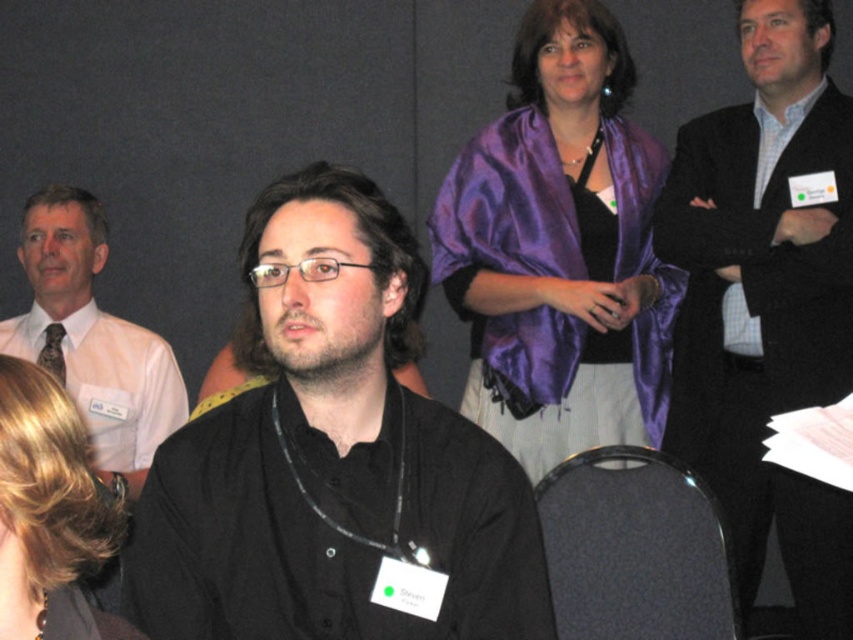
Question: Which object appears farthest from the camera in this image?

Choices:
 (A) black matte shirt at center
 (B) purple satin shawl at upper center
 (C) matte white shirt at left

Answer: (B)

Question: Does dark suit at right have a greater width compared to purple satin shawl at upper center?

Choices:
 (A) yes
 (B) no

Answer: (B)

Question: From the image, what is the correct spatial relationship of black fabric chair at lower center in relation to blonde hair at lower left?

Choices:
 (A) above
 (B) below

Answer: (B)

Question: Which object appears closest to the camera in this image?

Choices:
 (A) black fabric chair at lower center
 (B) purple satin shawl at upper center
 (C) blonde hair at lower left

Answer: (C)

Question: Does black fabric chair at lower center appear under matte white shirt at left?

Choices:
 (A) no
 (B) yes

Answer: (B)

Question: Estimate the real-world distances between objects in this image. Which object is closer to the blonde hair at lower left?

Choices:
 (A) black fabric chair at lower center
 (B) black matte shirt at center

Answer: (B)